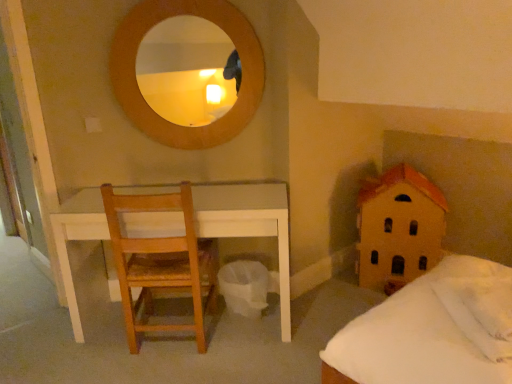
Question: Does wooden house at right come behind light brown wooden chair at left?

Choices:
 (A) no
 (B) yes

Answer: (B)

Question: Is wooden house at right thinner than light brown wooden chair at left?

Choices:
 (A) yes
 (B) no

Answer: (B)

Question: Is light brown wooden chair at left surrounded by wooden house at right?

Choices:
 (A) no
 (B) yes

Answer: (A)

Question: Is wooden house at right positioned before light brown wooden chair at left?

Choices:
 (A) yes
 (B) no

Answer: (B)

Question: From a real-world perspective, is wooden house at right under light brown wooden chair at left?

Choices:
 (A) no
 (B) yes

Answer: (B)

Question: From the image's perspective, is wooden house at right located beneath light brown wooden chair at left?

Choices:
 (A) no
 (B) yes

Answer: (A)

Question: Considering the relative positions of light brown wooden chair at left and wooden house at right in the image provided, is light brown wooden chair at left to the right of wooden house at right from the viewer's perspective?

Choices:
 (A) no
 (B) yes

Answer: (A)

Question: Is light brown wooden chair at left bigger than wooden house at right?

Choices:
 (A) yes
 (B) no

Answer: (B)

Question: Is light brown wooden chair at left outside of wooden house at right?

Choices:
 (A) yes
 (B) no

Answer: (A)

Question: Is light brown wooden chair at left further to the viewer compared to wooden house at right?

Choices:
 (A) no
 (B) yes

Answer: (A)

Question: Is the depth of light brown wooden chair at left less than that of wooden house at right?

Choices:
 (A) yes
 (B) no

Answer: (A)

Question: From the image's perspective, is light brown wooden chair at left below wooden house at right?

Choices:
 (A) yes
 (B) no

Answer: (A)

Question: Does white soft pillow at lower right, which ranks as the second pillow in back-to-front order, lie behind light brown wooden chair at left?

Choices:
 (A) no
 (B) yes

Answer: (A)